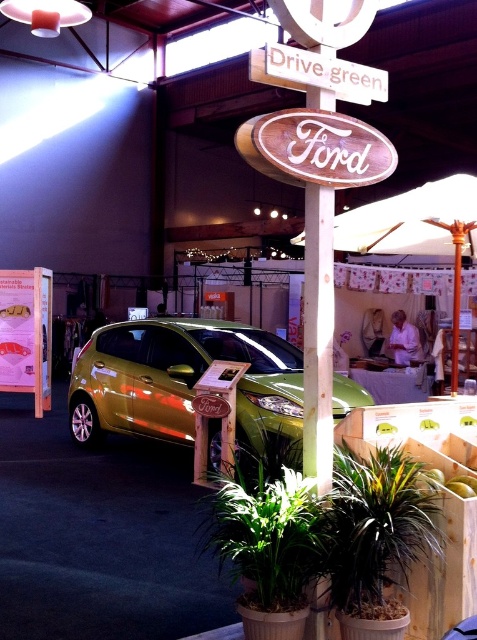
You are standing at the entrance of the exhibition booth and see the point marked at coordinates (186, 385). What object is located at that point?

The metallic gold car at center is located at point (186, 385).

You are standing at the entrance of the exhibition booth and want to locate the metallic gold car at center. According to the coordinates provided, in which direction should you look relative to your current position?

You should look towards the coordinates point at (186, 385) to find the metallic gold car at center.